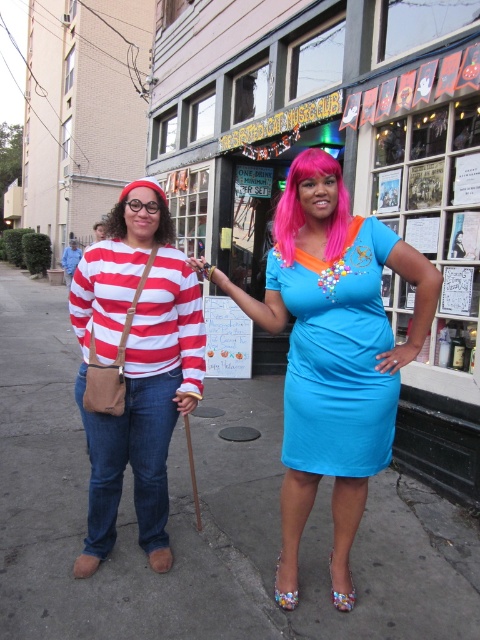
You are a photographer standing on the sidewalk and want to take a photo of the gray concrete pavement at lower center and the shiny blue dress at center. Which object is closer to you?

The gray concrete pavement at lower center is closer to you because the shiny blue dress at center is behind it.

You are standing at the entrance of The Red Cat Music Club and want to place a 2.5 feet wide decorative box on the gray concrete pavement at lower center. Can the pavement accommodate the box?

The gray concrete pavement at lower center is 7.35 feet away from the camera, so the distance is sufficient to place the 2.5 feet wide decorative box on the gray concrete pavement at lower center.

You are standing at the entrance of The Red Cat Music Club. You want to place a small potted plant on the gray concrete pavement at lower center. What are the coordinates where you should place it?

The coordinates for placing the small potted plant on the gray concrete pavement at lower center are at point [202,518].